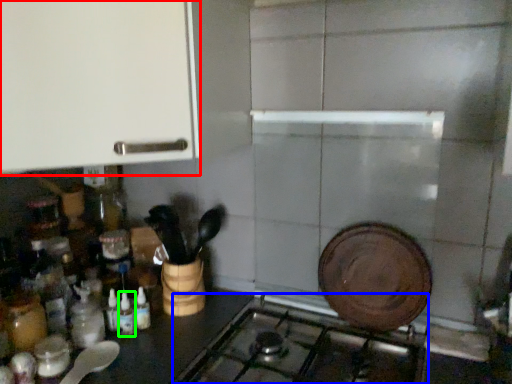
Question: Considering the real-world distances, which object is closest to cabinetry (highlighted by a red box)? gas stove (highlighted by a blue box) or bottle (highlighted by a green box).

Choices:
 (A) gas stove
 (B) bottle

Answer: (B)